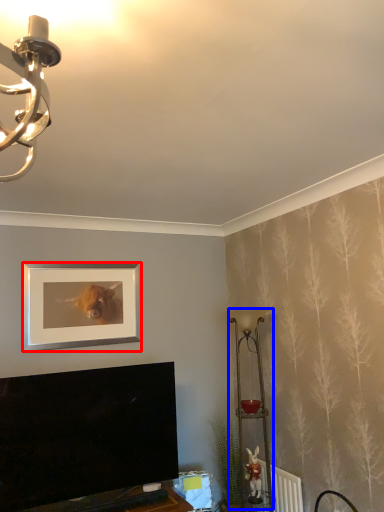
Question: Among these objects, which one is nearest to the camera, picture frame (highlighted by a red box) or table lamp (highlighted by a blue box)?

Choices:
 (A) picture frame
 (B) table lamp

Answer: (B)